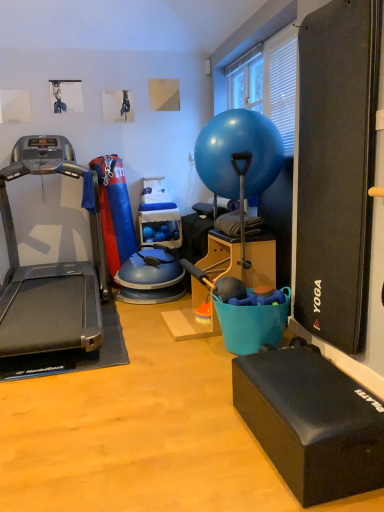
The height and width of the screenshot is (512, 384). I want to click on free spot to the left of black rubber yoga block at lower right, the 2th box positioned from the top, so click(x=187, y=443).